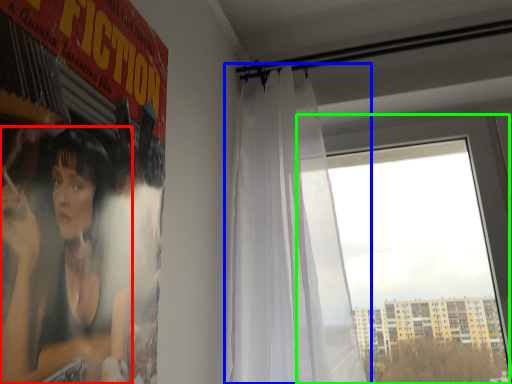
Question: Which object is the farthest from person (highlighted by a red box)? Choose among these: curtain (highlighted by a blue box) or window (highlighted by a green box).

Choices:
 (A) curtain
 (B) window

Answer: (B)